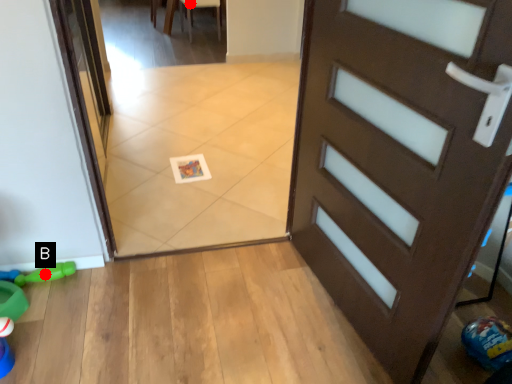
Question: Two points are circled on the image, labeled by A and B beside each circle. Which point is closer to the camera taking this photo?

Choices:
 (A) A is closer
 (B) B is closer

Answer: (B)